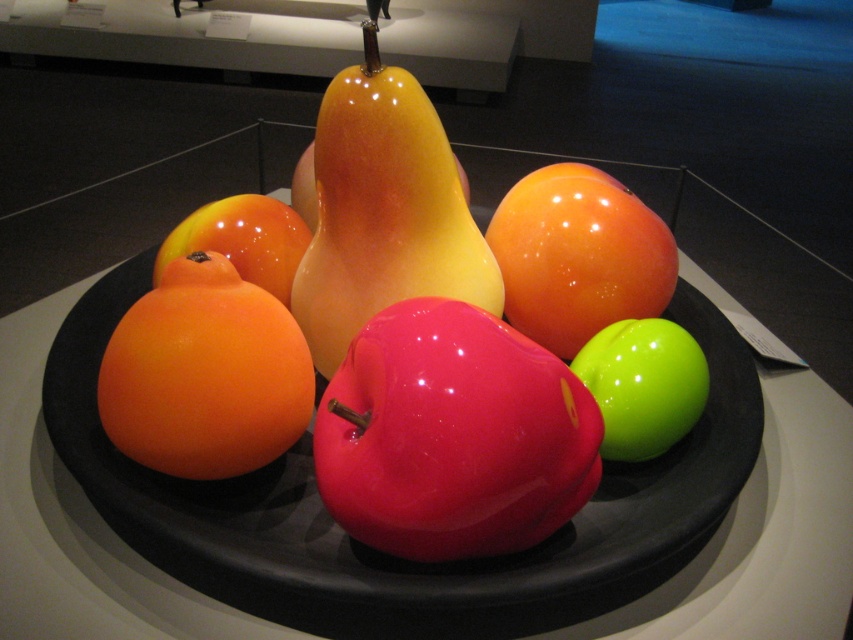
Is glossy red apple at center shorter than glossy neon green apple at center?

Incorrect, glossy red apple at center's height does not fall short of glossy neon green apple at center's.

How much distance is there between glossy red apple at center and glossy neon green apple at center?

They are 15.38 inches apart.

I want to click on glossy red apple at center, so click(x=451, y=435).

Where is `glossy red apple at center`? glossy red apple at center is located at coordinates (451, 435).

Who is taller, glossy red apple at center or glossy yellow pear at center?

glossy yellow pear at center

The height and width of the screenshot is (640, 853). I want to click on glossy red apple at center, so click(x=451, y=435).

Identify the location of glossy red apple at center. (451, 435).

Can you confirm if glossy yellow pear at center is shorter than glossy neon green apple at center?

Incorrect, glossy yellow pear at center's height does not fall short of glossy neon green apple at center's.

Based on the photo, which is more to the left, glossy yellow pear at center or glossy neon green apple at center?

glossy yellow pear at center is more to the left.

What do you see at coordinates (383, 211) in the screenshot? I see `glossy yellow pear at center` at bounding box center [383, 211].

What are the coordinates of `glossy yellow pear at center` in the screenshot? It's located at coord(383,211).